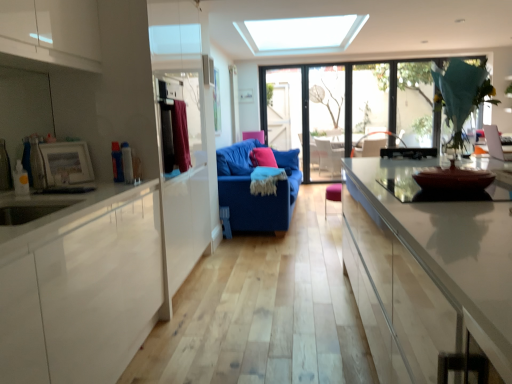
Question: Is transparent glass window at upper right, arranged as the first window when viewed from the right, shorter than velvet burgundy curtain at left?

Choices:
 (A) yes
 (B) no

Answer: (B)

Question: Can you see transparent glass window at upper right, the 2th window when ordered from left to right, touching velvet burgundy curtain at left?

Choices:
 (A) no
 (B) yes

Answer: (A)

Question: Can you confirm if transparent glass window at upper right, the 2th window when ordered from left to right, is positioned to the left of velvet burgundy curtain at left?

Choices:
 (A) yes
 (B) no

Answer: (B)

Question: Does transparent glass window at upper right, the 2th window when ordered from left to right, have a greater height compared to velvet burgundy curtain at left?

Choices:
 (A) yes
 (B) no

Answer: (A)

Question: From the image's perspective, is transparent glass window at upper right, arranged as the first window when viewed from the right, on velvet burgundy curtain at left?

Choices:
 (A) no
 (B) yes

Answer: (B)

Question: From a real-world perspective, is transparent glass window at upper right, arranged as the first window when viewed from the right, on velvet burgundy curtain at left?

Choices:
 (A) yes
 (B) no

Answer: (A)

Question: Does velvet burgundy curtain at left appear on the left side of blue fabric couch at center?

Choices:
 (A) no
 (B) yes

Answer: (B)

Question: Is velvet burgundy curtain at left next to blue fabric couch at center and touching it?

Choices:
 (A) no
 (B) yes

Answer: (A)

Question: From the image's perspective, does velvet burgundy curtain at left appear lower than blue fabric couch at center?

Choices:
 (A) yes
 (B) no

Answer: (A)

Question: From a real-world perspective, is velvet burgundy curtain at left on top of blue fabric couch at center?

Choices:
 (A) yes
 (B) no

Answer: (A)

Question: From the image's perspective, does velvet burgundy curtain at left appear higher than blue fabric couch at center?

Choices:
 (A) yes
 (B) no

Answer: (B)

Question: Considering the relative sizes of velvet burgundy curtain at left and blue fabric couch at center in the image provided, is velvet burgundy curtain at left bigger than blue fabric couch at center?

Choices:
 (A) no
 (B) yes

Answer: (A)

Question: Does transparent glass window at upper right, arranged as the first window when viewed from the right, have a greater width compared to pink fabric armchair at center?

Choices:
 (A) no
 (B) yes

Answer: (A)